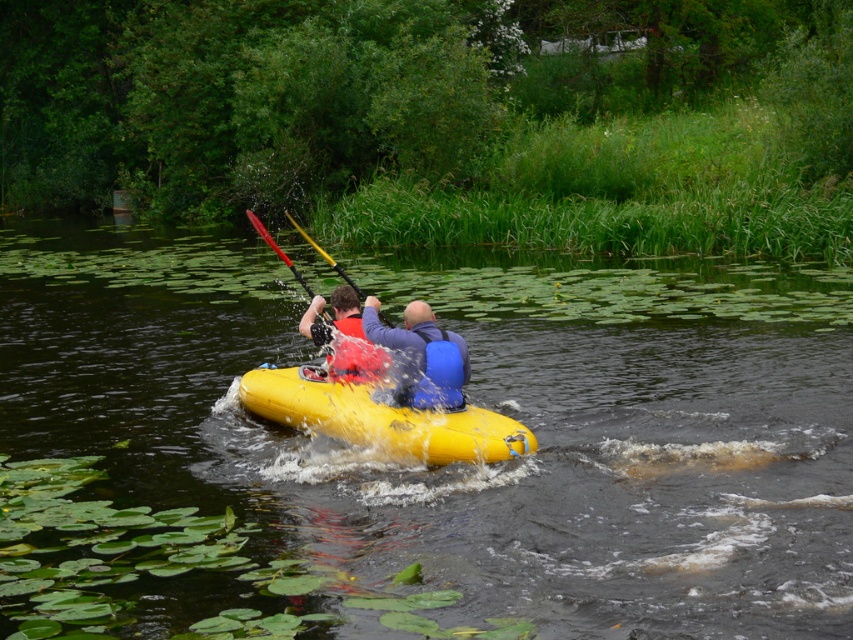
You are a drone operator trying to capture a photo of the matte blue life jacket at center. The drone is currently at the point with coordinates (355, 355). Is the drone directly above the matte blue life jacket at center?

Yes, the point at coordinates (355, 355) corresponds to the matte blue life jacket at center, so the drone is directly above it.

You are a safety inspector checking the kayakers. You notice two life jackets in the kayak. Which one is bigger between the matte black life vest at center and the matte blue life jacket at center?

The matte black life vest at center is larger than the matte blue life jacket at center.

You are standing on the dock and want to throw a life ring to the matte blue life jacket at center. The life ring has a throwing range of 30 feet. Can you reach it?

The matte blue life jacket at center and viewer are 34.24 feet apart. The life ring has a throwing range of 30 feet, so you cannot reach the matte blue life jacket at center with the life ring.